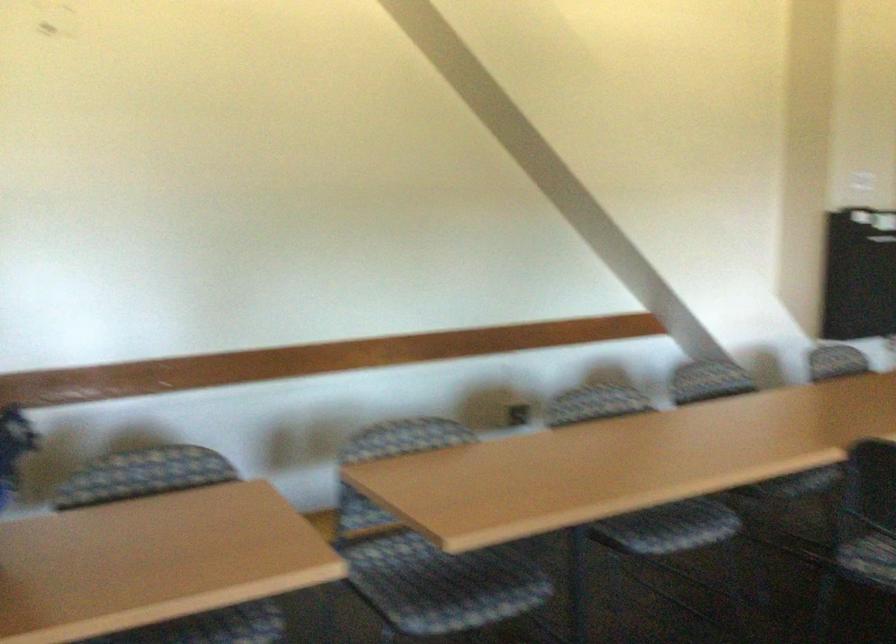
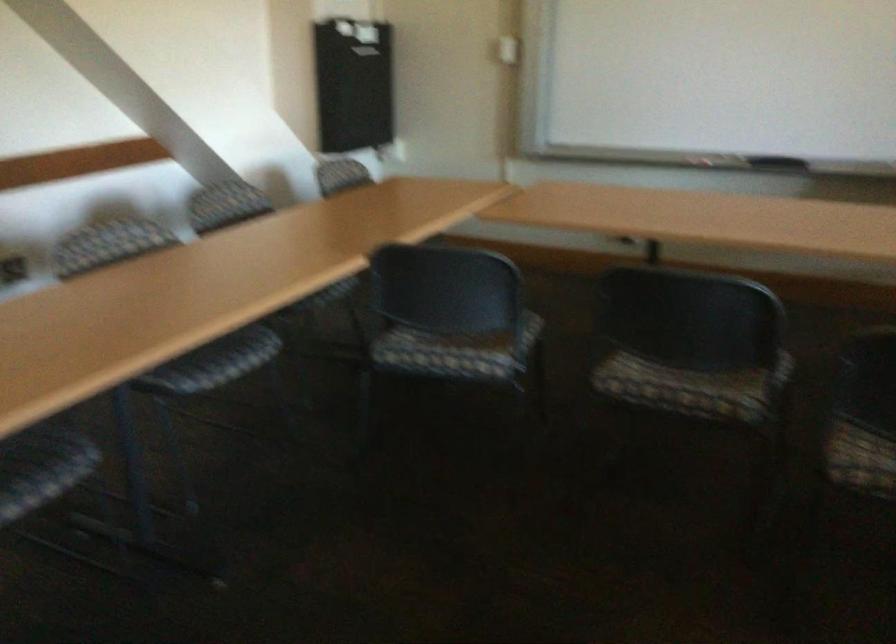
Locate, in the second image, the point that corresponds to [673,536] in the first image.

(219, 366)